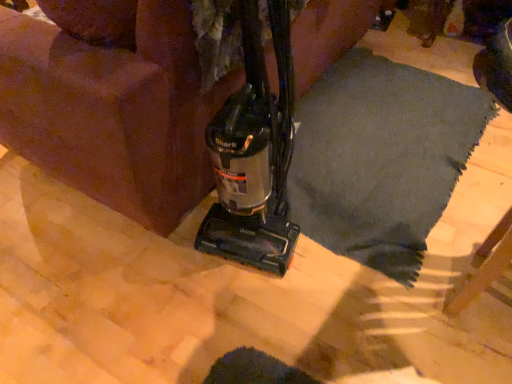
Measure the distance between metallic silver swivel chair at center and camera.

31.79 inches.

What do you see at coordinates (114, 112) in the screenshot? I see `metallic silver swivel chair at center` at bounding box center [114, 112].

What is the approximate width of metallic silver swivel chair at center?

metallic silver swivel chair at center is 3.60 feet wide.

Where is `metallic silver swivel chair at center`? metallic silver swivel chair at center is located at coordinates (114, 112).

You are a GUI agent. You are given a task and a screenshot of the screen. Output one action in this format:
    pyautogui.click(x=<x>, y=<y>)
    Task: Click on the metallic silver swivel chair at center
    The height and width of the screenshot is (384, 512).
    Given the screenshot: What is the action you would take?
    pyautogui.click(x=114, y=112)